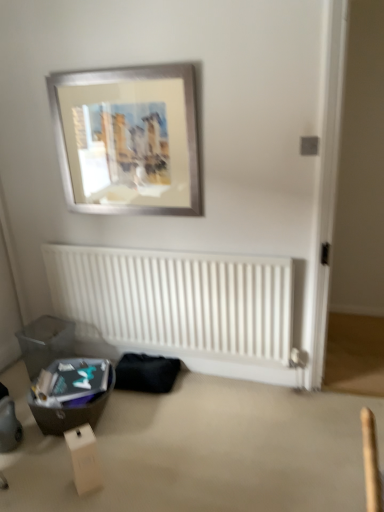
Question: Considering their positions, is white matte radiator at lower center located in front of or behind silver metallic picture frame at upper center?

Choices:
 (A) behind
 (B) front

Answer: (A)

Question: From the image's perspective, relative to silver metallic picture frame at upper center, is white matte radiator at lower center above or below?

Choices:
 (A) above
 (B) below

Answer: (B)

Question: Estimate the real-world distances between objects in this image. Which object is closer to the white matte radiator at lower center?

Choices:
 (A) silver metallic picture frame at upper center
 (B) white cardboard box at lower left
 (C) matte black storage box at lower left, marked as the 1th storage box in a front-to-back arrangement
 (D) translucent plastic storage box at lower left, which is the second storage box in front-to-back order

Answer: (D)

Question: Estimate the real-world distances between objects in this image. Which object is closer to the translucent plastic storage box at lower left, which is the second storage box in front-to-back order?

Choices:
 (A) silver metallic picture frame at upper center
 (B) white cardboard box at lower left
 (C) white matte radiator at lower center
 (D) matte black storage box at lower left, marked as the 1th storage box in a front-to-back arrangement

Answer: (D)